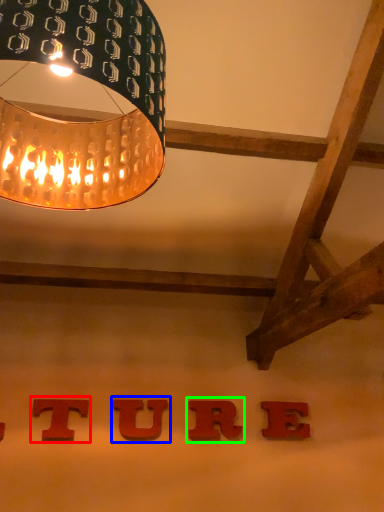
Question: Which is farther away from alphabet (highlighted by a red box)? alphabet (highlighted by a blue box) or alphabet (highlighted by a green box)?

Choices:
 (A) alphabet
 (B) alphabet

Answer: (B)